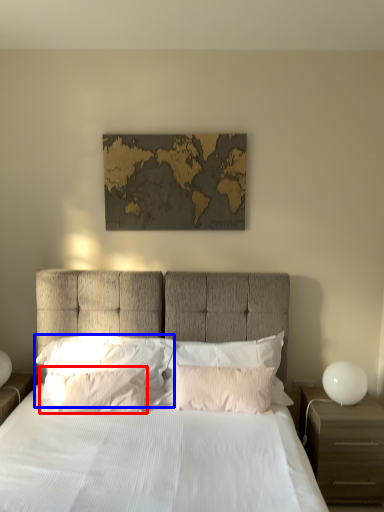
Question: Which object is further to the camera taking this photo, pillow (highlighted by a red box) or pillow (highlighted by a blue box)?

Choices:
 (A) pillow
 (B) pillow

Answer: (B)